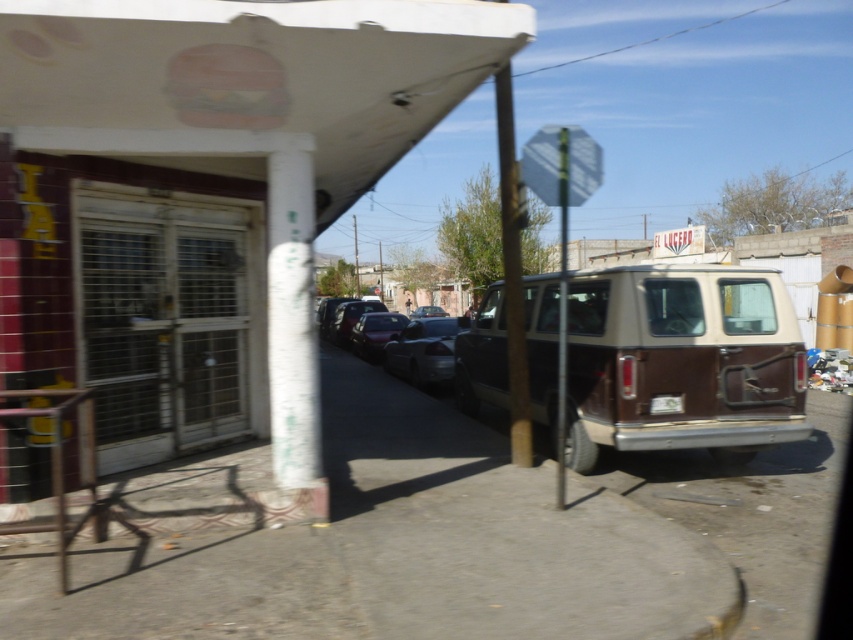
Describe the element at coordinates (407, 346) in the screenshot. I see `shiny black sedan at center` at that location.

Between shiny black sedan at center and metallic pole at center, which one has less height?

With less height is shiny black sedan at center.

Where is `shiny black sedan at center`? The height and width of the screenshot is (640, 853). shiny black sedan at center is located at coordinates (407, 346).

Where is `shiny black sedan at center`? shiny black sedan at center is located at coordinates (407, 346).

From the picture: Can you confirm if brown matte van at center is positioned above metallic pole at center?

Actually, brown matte van at center is below metallic pole at center.

Can you confirm if brown matte van at center is positioned to the right of metallic pole at center?

In fact, brown matte van at center is to the left of metallic pole at center.

What do you see at coordinates (682, 360) in the screenshot? I see `brown matte van at center` at bounding box center [682, 360].

The image size is (853, 640). What are the coordinates of `brown matte van at center` in the screenshot? It's located at [682, 360].

In the scene shown: Who is taller, glossy metallic car at center or white plastic license plate at rear?

glossy metallic car at center is taller.

Between glossy metallic car at center and white plastic license plate at rear, which one is positioned higher?

white plastic license plate at rear is above.

Which is behind, point (379, 340) or point (668, 412)?

The point (379, 340) is behind.

I want to click on glossy metallic car at center, so [x=374, y=332].